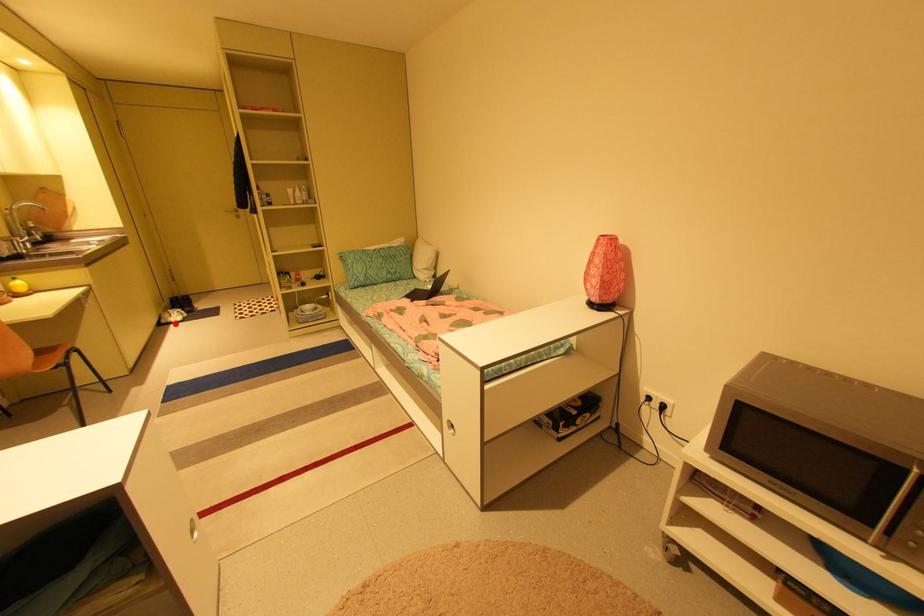
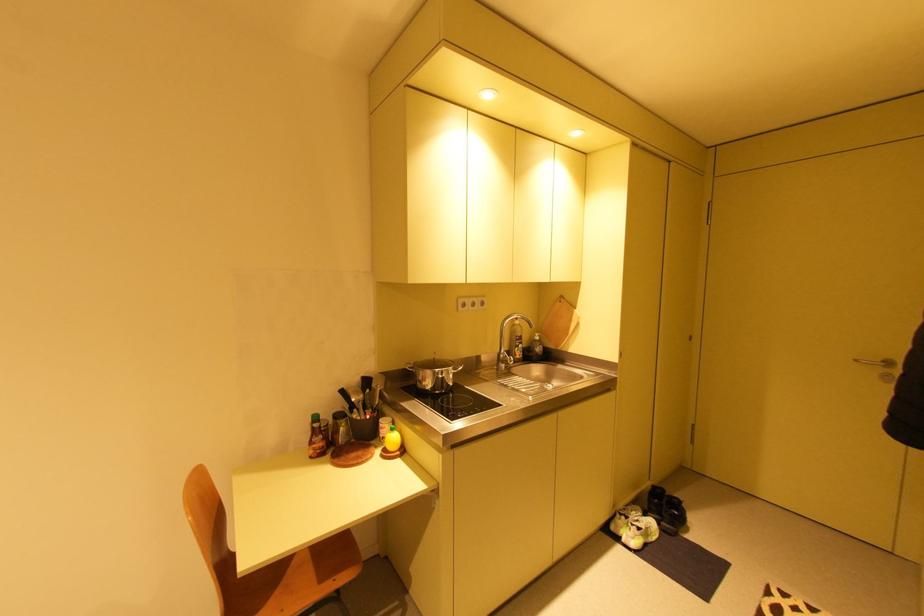
Question: I am providing you with two images of the same scene from different viewpoints. Given a red point in image1, look at the same physical point in image2. Is it:

Choices:
 (A) Closer to the viewpoint
 (B) Farther from the viewpoint

Answer: (B)